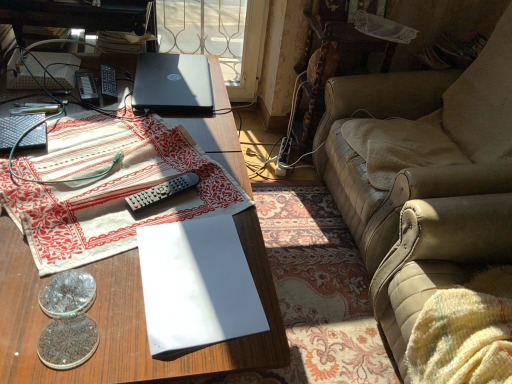
Image resolution: width=512 pixels, height=384 pixels. What are the coordinates of `free area in between gray plastic remote at center, which ranks as the first remote control in right-to-left order, and black plastic remote control at upper left, the 2th remote control when ordered from top to bottom` in the screenshot? It's located at (124, 143).